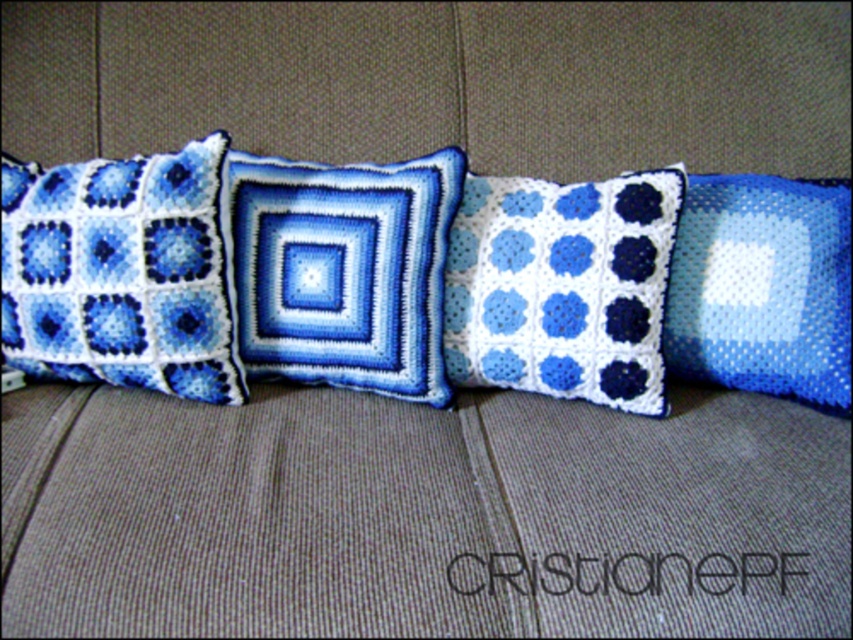
You are looking at the arrangement of crochet pillows on the textured brown fabric surface. There are two points marked in the scene, one at coordinates point (39, 321) and another at point (764, 212). Which point is nearer to you?

Point (39, 321) is closer to the viewer than point (764, 212).

You are arranging pillows on a sofa and want to ensure the crochet fabric pillow at left and blue mesh pillow at right are visible. Based on their positions, which one is closer to you?

The crochet fabric pillow at left is closer to you since it is positioned in front of the blue mesh pillow at right.

You are arranging these pillows on a shelf. The white crochet pillow at center needs to be placed to the left of the blue mesh pillow at right. Which pillow should you move first to maintain the correct order?

The blue mesh pillow at right should be moved first to ensure the white crochet pillow at center remains to the left of it.